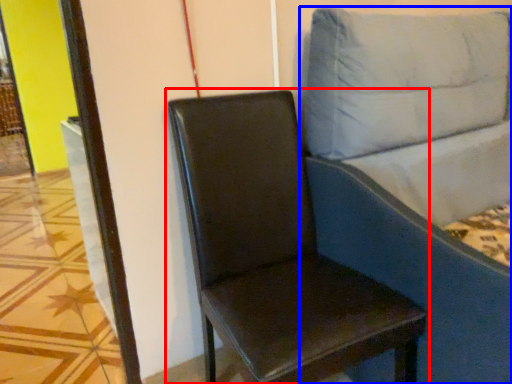
Question: Which object appears closest to the camera in this image, chair (highlighted by a red box) or studio couch (highlighted by a blue box)?

Choices:
 (A) chair
 (B) studio couch

Answer: (B)